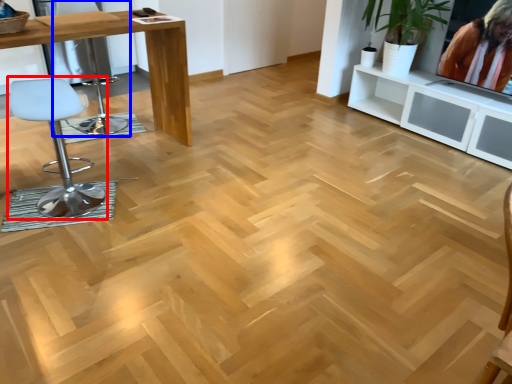
Question: Among these objects, which one is nearest to the camera, chair (highlighted by a red box) or swivel chair (highlighted by a blue box)?

Choices:
 (A) chair
 (B) swivel chair

Answer: (A)